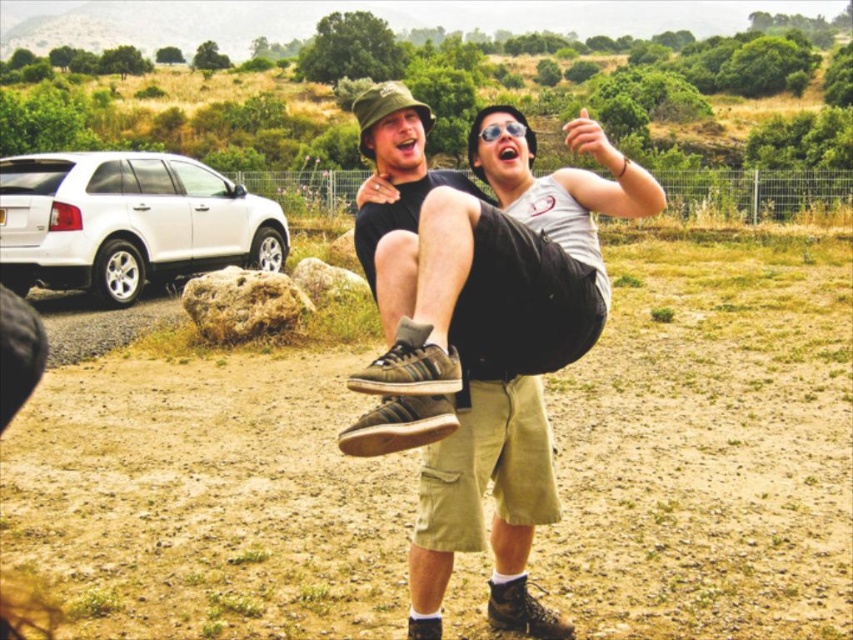
Describe the element at coordinates (708, 449) in the screenshot. The image size is (853, 640). I see `brown sandy ground at center` at that location.

Which of these two, brown sandy ground at center or white matte suv at left, stands taller?

With more height is brown sandy ground at center.

Locate an element on the screen. This screenshot has height=640, width=853. brown sandy ground at center is located at coordinates (708, 449).

Is point (519, 461) positioned before point (22, 269)?

That is True.

Between matte black shorts at center and white matte suv at left, which one appears on the left side from the viewer's perspective?

white matte suv at left is more to the left.

Which is behind, point (552, 216) or point (49, 198)?

The point (49, 198) is more distant.

This screenshot has width=853, height=640. Identify the location of matte black shorts at center. (497, 342).

Where is `brown sandy ground at center`? The width and height of the screenshot is (853, 640). brown sandy ground at center is located at coordinates coord(708,449).

Is brown sandy ground at center taller than matte black shorts at center?

In fact, brown sandy ground at center may be shorter than matte black shorts at center.

The width and height of the screenshot is (853, 640). What do you see at coordinates (708, 449) in the screenshot?
I see `brown sandy ground at center` at bounding box center [708, 449].

Locate an element on the screen. brown sandy ground at center is located at coordinates (708, 449).